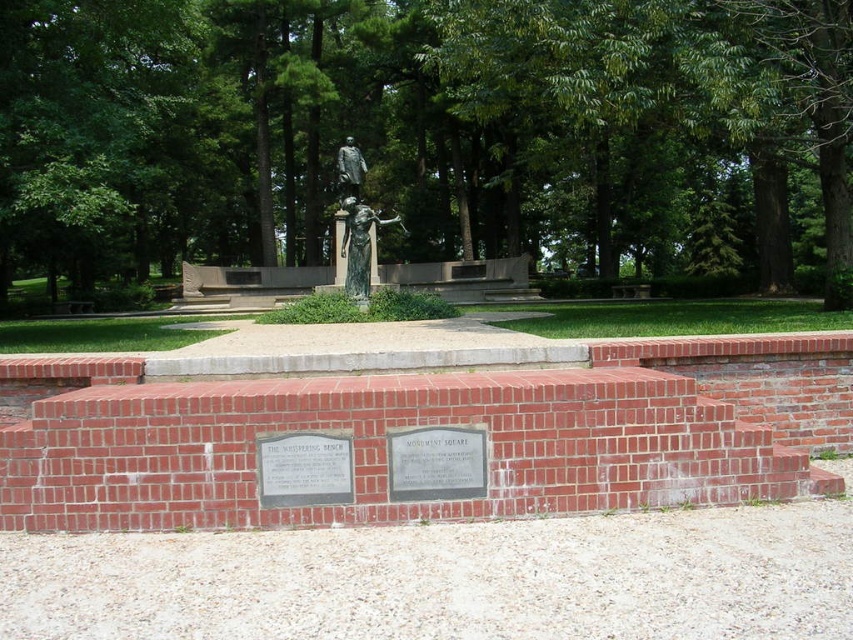
Question: Is the position of green leafy tree at center more distant than that of bronze statue at center?

Choices:
 (A) yes
 (B) no

Answer: (B)

Question: Where is green patina bronze statue at center located in relation to bronze statue at center in the image?

Choices:
 (A) below
 (B) above

Answer: (A)

Question: Can you confirm if green leafy tree at center is thinner than bronze statue at center?

Choices:
 (A) no
 (B) yes

Answer: (A)

Question: Which object is farther from the camera taking this photo?

Choices:
 (A) bronze statue at center
 (B) green patina bronze statue at center
 (C) green leafy tree at center

Answer: (A)

Question: Which of the following is the farthest from the observer?

Choices:
 (A) (341, 179)
 (B) (180, 170)
 (C) (343, 168)

Answer: (B)

Question: Which point is closer to the camera?

Choices:
 (A) green leafy tree at center
 (B) green patina bronze statue at center
 (C) bronze statue at center

Answer: (A)